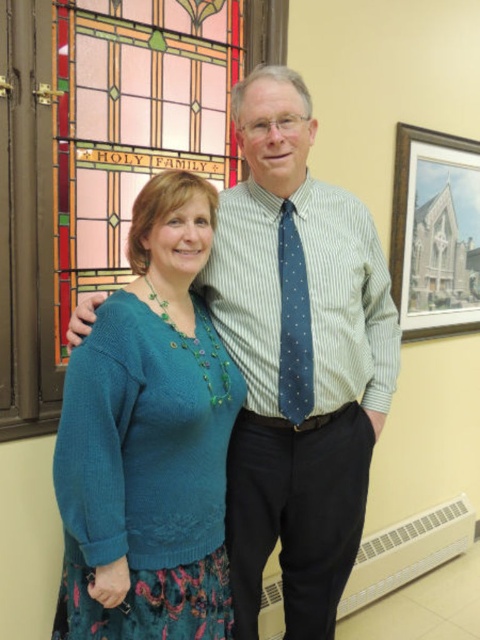
You are an interior designer assessing the wall decorations in a room. You notice the wooden framed print at upper right and the blue dotted tie at center. Which object is taller?

The wooden framed print at upper right is much taller than the blue dotted tie at center.

What is the color of the object located at point (148,440) in the image?

The object at point (148,440) is the teal knitted sweater at center, which is teal in color.